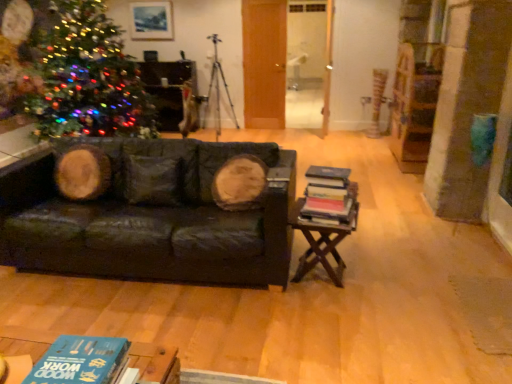
Question: From a real-world perspective, is hardcover books at right, which ranks as the second book in front-to-back order, under metallic tripod at center?

Choices:
 (A) no
 (B) yes

Answer: (B)

Question: Can you confirm if hardcover books at right, which ranks as the second book in front-to-back order, is positioned to the left of metallic tripod at center?

Choices:
 (A) no
 (B) yes

Answer: (A)

Question: Considering the relative sizes of hardcover books at right, which is counted as the first book, starting from the right, and metallic tripod at center in the image provided, is hardcover books at right, which is counted as the first book, starting from the right, bigger than metallic tripod at center?

Choices:
 (A) yes
 (B) no

Answer: (B)

Question: From a real-world perspective, is hardcover books at right, which is counted as the first book, starting from the right, over metallic tripod at center?

Choices:
 (A) yes
 (B) no

Answer: (B)

Question: Is hardcover books at right, which is counted as the first book, starting from the right, positioned behind metallic tripod at center?

Choices:
 (A) no
 (B) yes

Answer: (A)

Question: Considering the positions of point (214, 72) and point (168, 4), is point (214, 72) closer or farther from the camera than point (168, 4)?

Choices:
 (A) farther
 (B) closer

Answer: (A)

Question: Is metallic tripod at center spatially inside matte wooden picture frame at upper center, or outside of it?

Choices:
 (A) inside
 (B) outside

Answer: (B)

Question: From the image's perspective, relative to matte wooden picture frame at upper center, is metallic tripod at center above or below?

Choices:
 (A) above
 (B) below

Answer: (B)

Question: From a real-world perspective, is metallic tripod at center above or below matte wooden picture frame at upper center?

Choices:
 (A) above
 (B) below

Answer: (B)

Question: Considering the positions of point (61, 374) and point (214, 66), is point (61, 374) closer or farther from the camera than point (214, 66)?

Choices:
 (A) closer
 (B) farther

Answer: (A)

Question: Which is correct: blue matte book at lower left, the 2th book from the top, is inside metallic tripod at center, or outside of it?

Choices:
 (A) outside
 (B) inside

Answer: (A)

Question: Would you say blue matte book at lower left, placed as the 1th book when sorted from front to back, is to the left or to the right of metallic tripod at center in the picture?

Choices:
 (A) right
 (B) left

Answer: (A)

Question: In terms of size, does blue matte book at lower left, placed as the 1th book when sorted from left to right, appear bigger or smaller than metallic tripod at center?

Choices:
 (A) big
 (B) small

Answer: (B)

Question: Considering the positions of multicolored lights at left and blue matte book at lower left, placed as the 1th book when sorted from front to back, in the image, is multicolored lights at left bigger or smaller than blue matte book at lower left, placed as the 1th book when sorted from front to back,?

Choices:
 (A) big
 (B) small

Answer: (A)

Question: Would you say multicolored lights at left is inside or outside blue matte book at lower left, placed as the 1th book when sorted from front to back?

Choices:
 (A) inside
 (B) outside

Answer: (B)